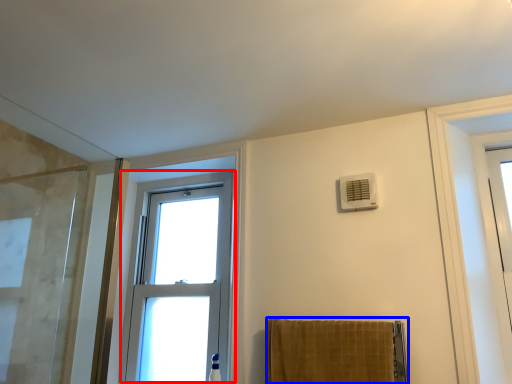
Question: Among these objects, which one is nearest to the camera, window (highlighted by a red box) or towel (highlighted by a blue box)?

Choices:
 (A) window
 (B) towel

Answer: (B)